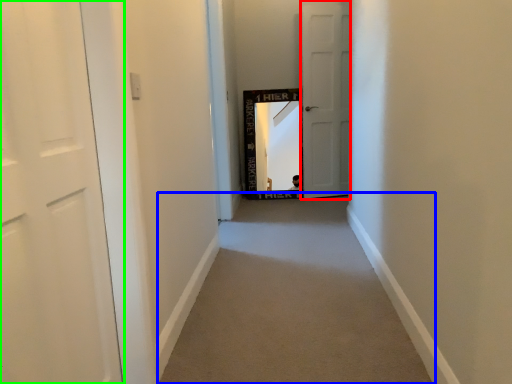
Question: Which is farther away from door (highlighted by a red box)? alley (highlighted by a blue box) or door (highlighted by a green box)?

Choices:
 (A) alley
 (B) door

Answer: (B)